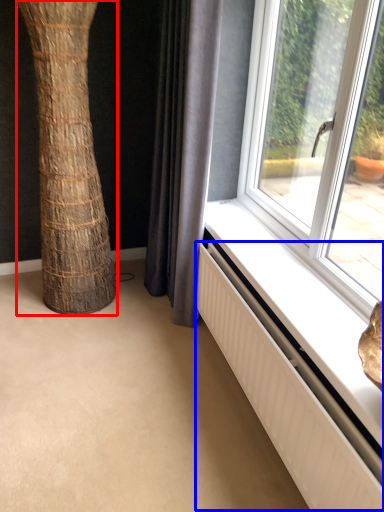
Question: Which of the following is the farthest to the observer, tree trunk (highlighted by a red box) or radiator (highlighted by a blue box)?

Choices:
 (A) tree trunk
 (B) radiator

Answer: (A)